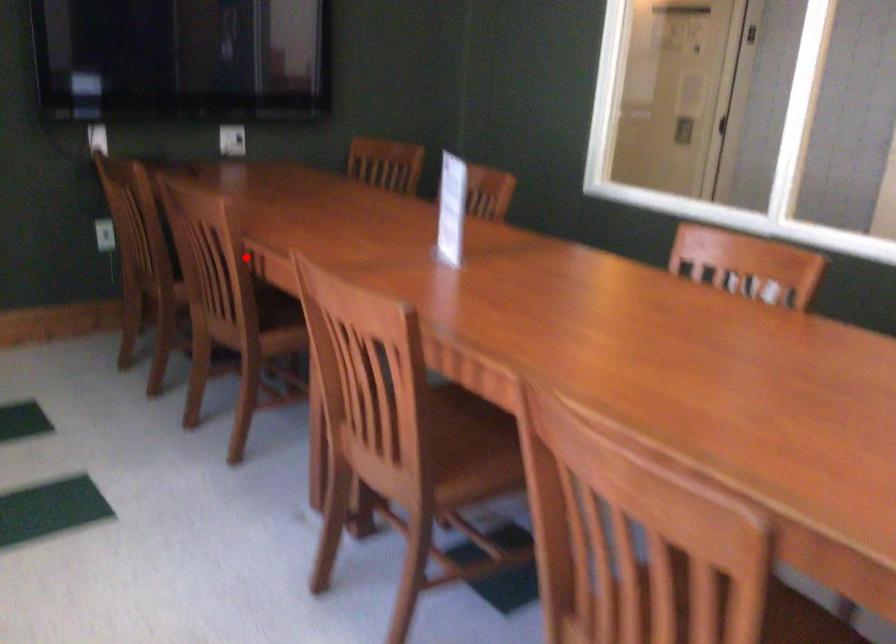
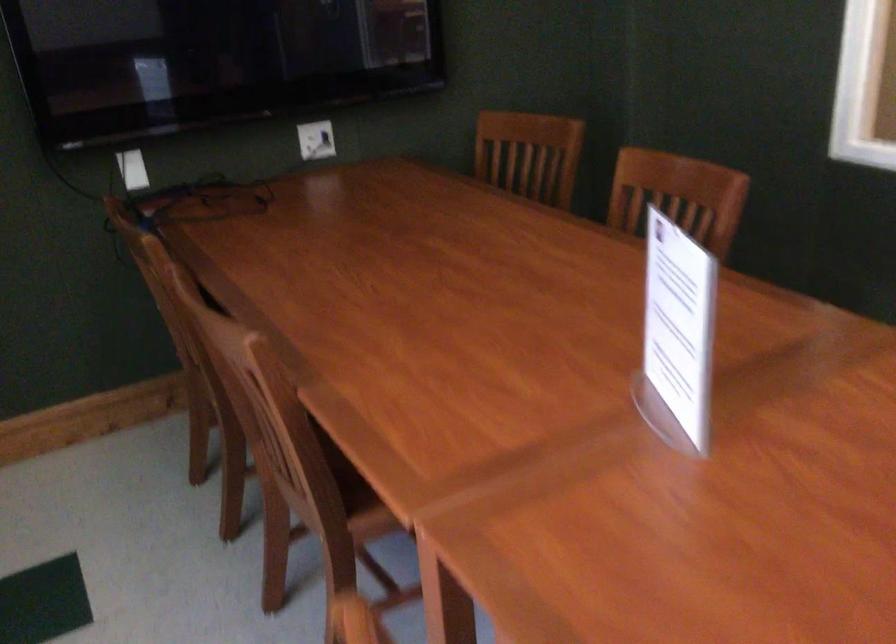
Locate, in the second image, the point that corresponds to the highlighted location in the first image.

(299, 413)